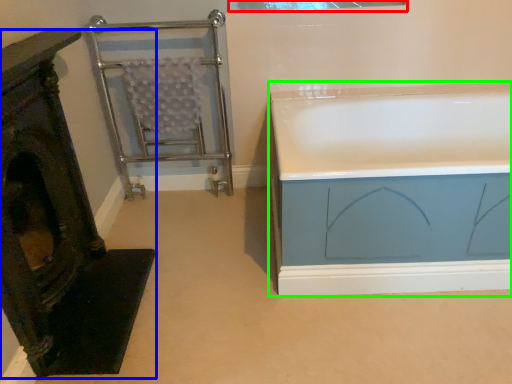
Question: Which is farther away from window (highlighted by a red box)? furniture (highlighted by a blue box) or bathtub (highlighted by a green box)?

Choices:
 (A) furniture
 (B) bathtub

Answer: (A)